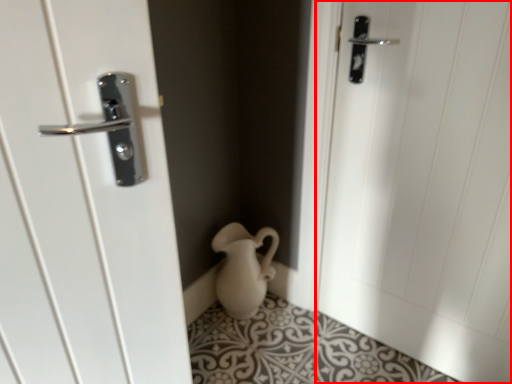
Question: From the image, what is the correct spatial relationship of door (annotated by the red box) in relation to jug?

Choices:
 (A) right
 (B) left

Answer: (A)